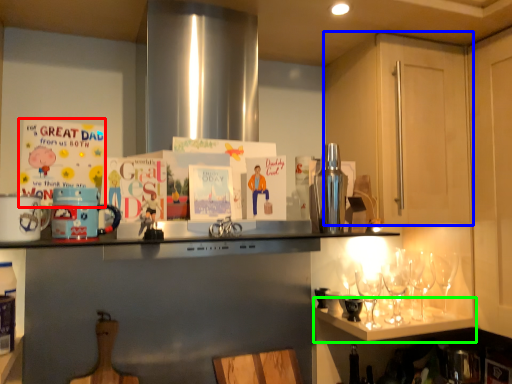
Question: Which is nearer to the postcard (highlighted by a red box)? cabinetry (highlighted by a blue box) or shelf (highlighted by a green box).

Choices:
 (A) cabinetry
 (B) shelf

Answer: (A)